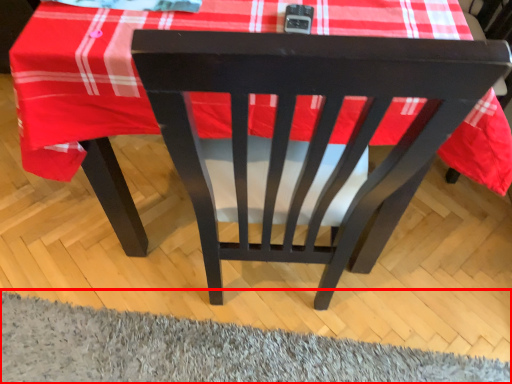
Question: In this image, where is mat (annotated by the red box) located relative to chair?

Choices:
 (A) right
 (B) left

Answer: (A)